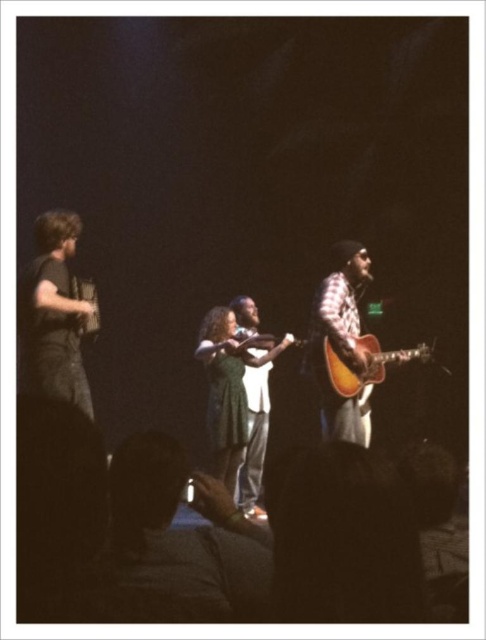
Based on the scene description, where is the plaid fabric guitar at center located in the image?

The plaid fabric guitar at center is located at point 0.530 in the x coordinate and 0.700 in the y coordinate.

You are a stagehand setting up for a performance. You need to place a plaid fabric guitar at center and an acoustic wood guitar at center on the stage. The stage has limited space between the violinist and the accordion player. Which guitar should you place closer to the violinist to ensure there is enough space?

The acoustic wood guitar at center is smaller than the plaid fabric guitar at center, so placing the acoustic wood guitar at center closer to the violinist would allow more space for the larger plaid fabric guitar at center between the violinist and accordion player.